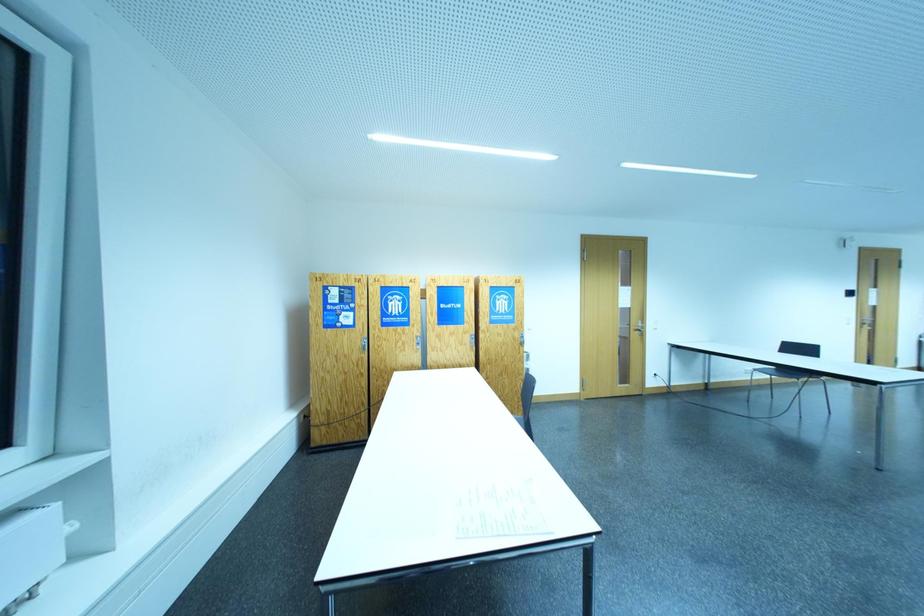
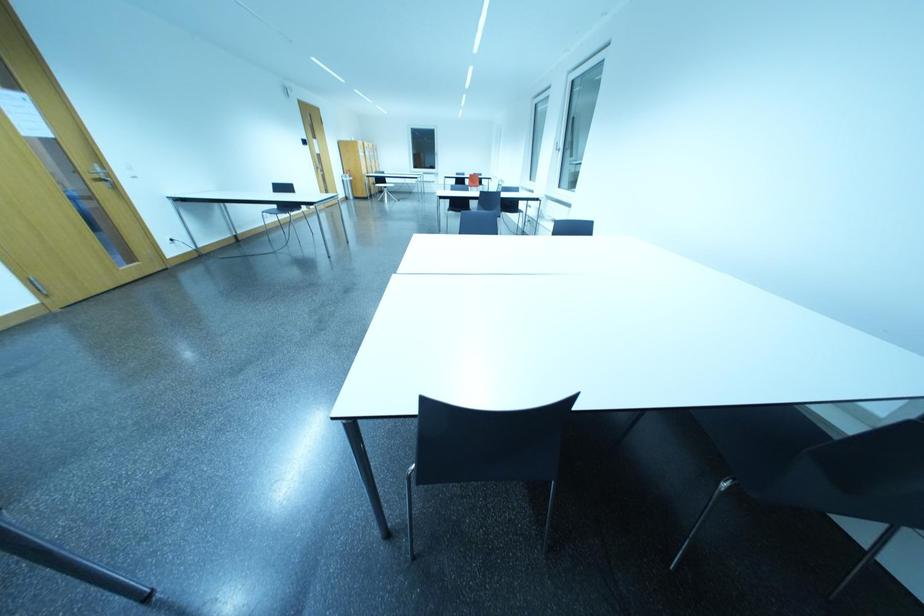
Based on the continuous images, in which direction is the camera rotating?

The rotation direction of the camera is right-down.